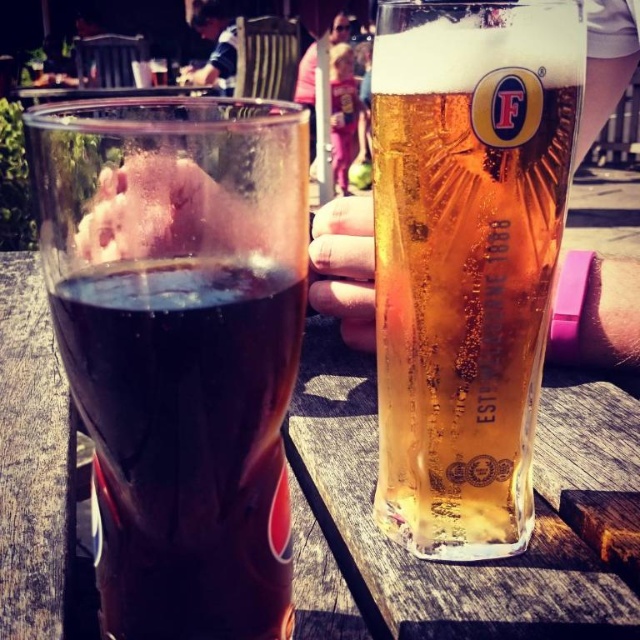
You are a bartender who needs to place a new drink order. You see the transparent glass at center and the wooden table at center. Which object is located higher?

The transparent glass at center is above the wooden table at center, so it is higher.